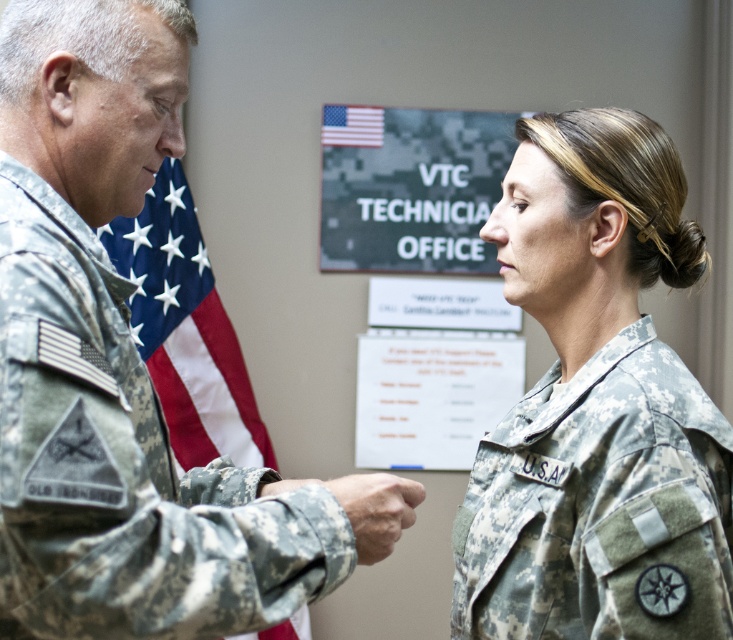
Question: Based on their relative distances, which object is farther from the camouflage uniform at left?

Choices:
 (A) camouflage fabric flag at center
 (B) camouflage fabric signboard at center

Answer: (B)

Question: Does camouflage fabric uniform at right have a larger size compared to camouflage fabric flag at center?

Choices:
 (A) yes
 (B) no

Answer: (B)

Question: Which is nearer to the camouflage fabric signboard at center?

Choices:
 (A) camouflage fabric flag at center
 (B) camouflage uniform at left
 (C) camouflage fabric uniform at right

Answer: (A)

Question: Can you confirm if camouflage uniform at left is thinner than camouflage fabric uniform at right?

Choices:
 (A) no
 (B) yes

Answer: (A)

Question: Which object is farther from the camera taking this photo?

Choices:
 (A) matte camouflage hand at center
 (B) camouflage fabric signboard at center
 (C) white paper at center

Answer: (C)

Question: Is camouflage uniform at left further to camera compared to camouflage fabric uniform at right?

Choices:
 (A) no
 (B) yes

Answer: (A)